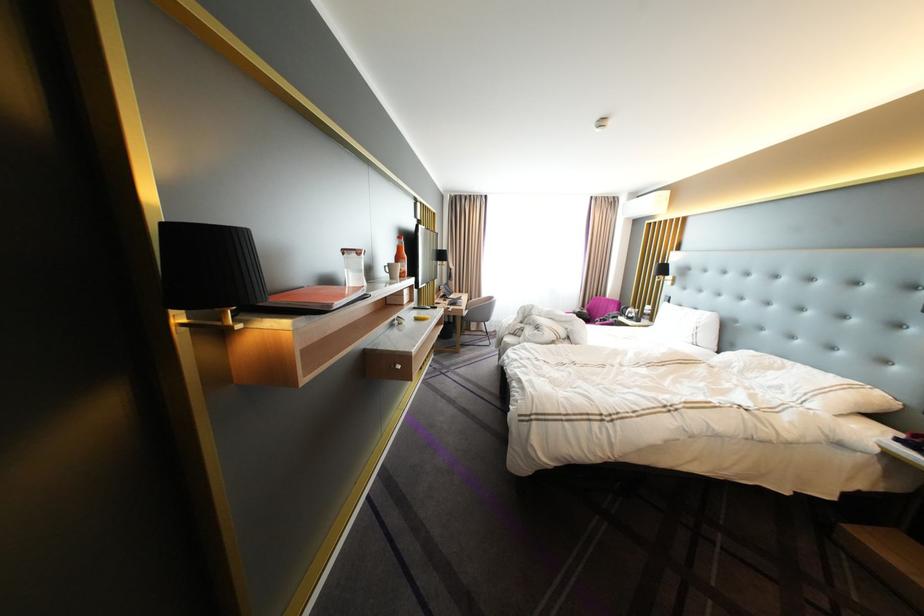
Which object does [353,265] point to?

It corresponds to the clear plastic container in the image.